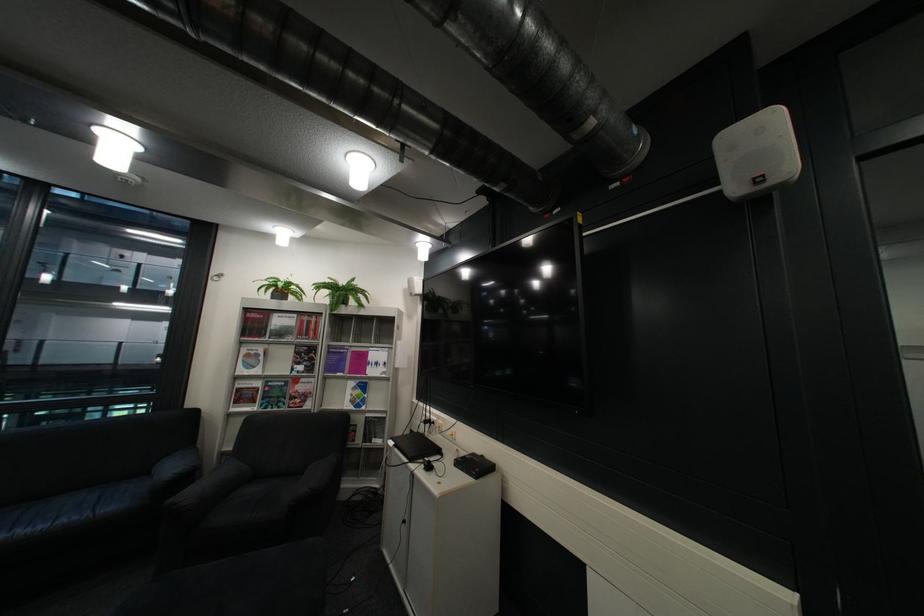
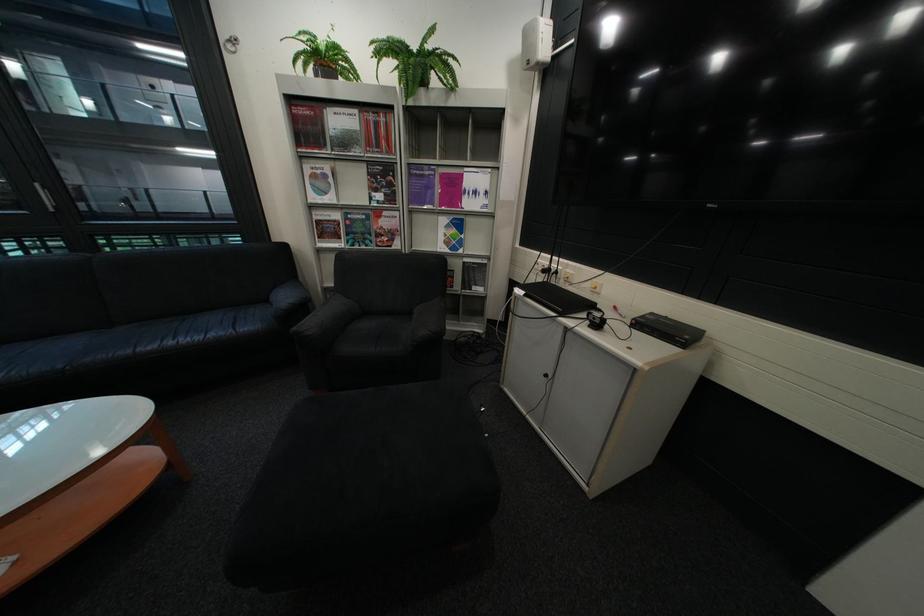
The point at (162, 474) is marked in the first image. Where is the corresponding point in the second image?

(282, 301)